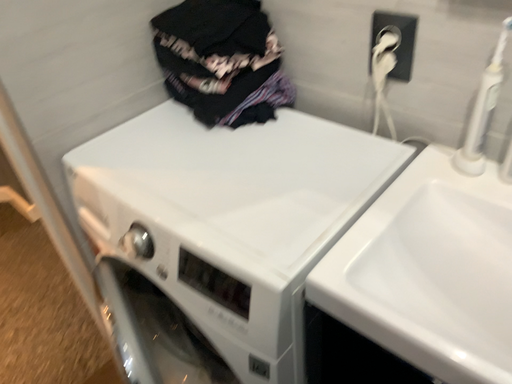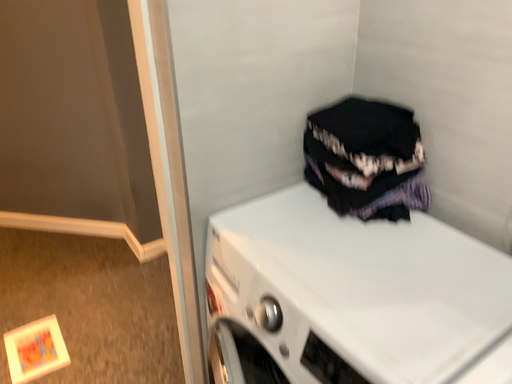
Question: Which way did the camera rotate in the video?

Choices:
 (A) rotated left
 (B) rotated right

Answer: (A)